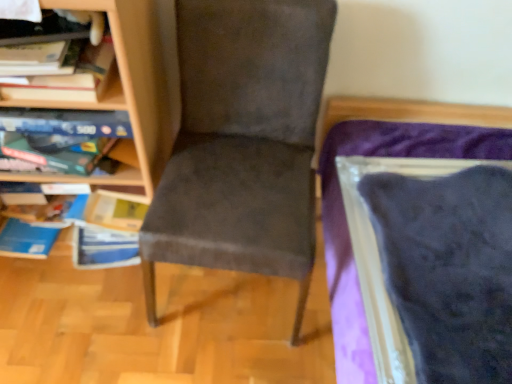
This screenshot has width=512, height=384. Describe the element at coordinates (243, 142) in the screenshot. I see `suede-like gray chair at center` at that location.

In order to face suede-like gray chair at center, should I rotate leftwards or rightwards?

It's best to rotate left around 2.855 degrees.

The height and width of the screenshot is (384, 512). In order to click on suede-like gray chair at center in this screenshot , I will do `click(243, 142)`.

This screenshot has width=512, height=384. Describe the element at coordinates (124, 93) in the screenshot. I see `wooden bookcase at left` at that location.

What are the coordinates of `wooden bookcase at left` in the screenshot? It's located at (124, 93).

Find the location of a particular element. The height and width of the screenshot is (384, 512). suede-like gray chair at center is located at coordinates (243, 142).

Which object is positioned more to the right, suede-like gray chair at center or wooden bookcase at left?

Positioned to the right is suede-like gray chair at center.

In the image, is suede-like gray chair at center positioned in front of or behind wooden bookcase at left?

In the image, suede-like gray chair at center appears in front of wooden bookcase at left.

Which is in front, point (298, 269) or point (117, 33)?

The point (117, 33) is closer to the camera.

From the image's perspective, is suede-like gray chair at center located beneath wooden bookcase at left?

Yes, from the image's perspective, suede-like gray chair at center is below wooden bookcase at left.

From a real-world perspective, between suede-like gray chair at center and wooden bookcase at left, who is vertically higher?

wooden bookcase at left is physically above.

Which object is wider, suede-like gray chair at center or wooden bookcase at left?

Wider between the two is suede-like gray chair at center.

Between suede-like gray chair at center and wooden bookcase at left, which one has less height?

suede-like gray chair at center.

From the picture: Considering the sizes of objects suede-like gray chair at center and wooden bookcase at left in the image provided, who is bigger, suede-like gray chair at center or wooden bookcase at left?

Bigger between the two is wooden bookcase at left.

In the scene shown: Is wooden bookcase at left inside suede-like gray chair at center?

No, wooden bookcase at left is not inside suede-like gray chair at center.

Is suede-like gray chair at center not close to wooden bookcase at left?

suede-like gray chair at center is actually quite close to wooden bookcase at left.

Based on the photo, could you tell me if suede-like gray chair at center is turned towards wooden bookcase at left?

No, suede-like gray chair at center is not oriented towards wooden bookcase at left.

You are a GUI agent. You are given a task and a screenshot of the screen. Output one action in this format:
    pyautogui.click(x=<x>, y=<y>)
    Task: Click on the chair directly beneath the wooden bookcase at left (from a real-world perspective)
    
    Given the screenshot: What is the action you would take?
    pyautogui.click(x=243, y=142)

Is wooden bookcase at left to the left of suede-like gray chair at center from the viewer's perspective?

Correct, you'll find wooden bookcase at left to the left of suede-like gray chair at center.

Which is behind, wooden bookcase at left or suede-like gray chair at center?

wooden bookcase at left is more distant.

Which is closer, (153, 175) or (203, 12)?

The point (203, 12) is closer.

In the scene shown: From the image's perspective, is wooden bookcase at left above or below suede-like gray chair at center?

wooden bookcase at left is above suede-like gray chair at center.

From a real-world perspective, is wooden bookcase at left beneath suede-like gray chair at center?

No, from a real-world perspective, wooden bookcase at left is not below suede-like gray chair at center.

Considering the sizes of objects wooden bookcase at left and suede-like gray chair at center in the image provided, who is thinner, wooden bookcase at left or suede-like gray chair at center?

With smaller width is wooden bookcase at left.

Can you confirm if wooden bookcase at left is taller than suede-like gray chair at center?

Indeed, wooden bookcase at left has a greater height compared to suede-like gray chair at center.

Which of these two, wooden bookcase at left or suede-like gray chair at center, is smaller?

suede-like gray chair at center is smaller.

Is wooden bookcase at left located outside suede-like gray chair at center?

Indeed, wooden bookcase at left is completely outside suede-like gray chair at center.

Based on the photo, is the surface of wooden bookcase at left in direct contact with suede-like gray chair at center?

No, wooden bookcase at left is not next to suede-like gray chair at center.

Could you tell me if wooden bookcase at left is turned towards suede-like gray chair at center?

No, wooden bookcase at left is not turned towards suede-like gray chair at center.

Measure the distance between wooden bookcase at left and suede-like gray chair at center.

wooden bookcase at left is 8.95 inches away from suede-like gray chair at center.

Identify the location of chair in front of the wooden bookcase at left. This screenshot has width=512, height=384. (243, 142).

You are a GUI agent. You are given a task and a screenshot of the screen. Output one action in this format:
    pyautogui.click(x=<x>, y=<y>)
    Task: Click on the bookcase on the left of suede-like gray chair at center
    This screenshot has height=384, width=512.
    Given the screenshot: What is the action you would take?
    pyautogui.click(x=124, y=93)

Identify the location of chair on the right of wooden bookcase at left. (243, 142).